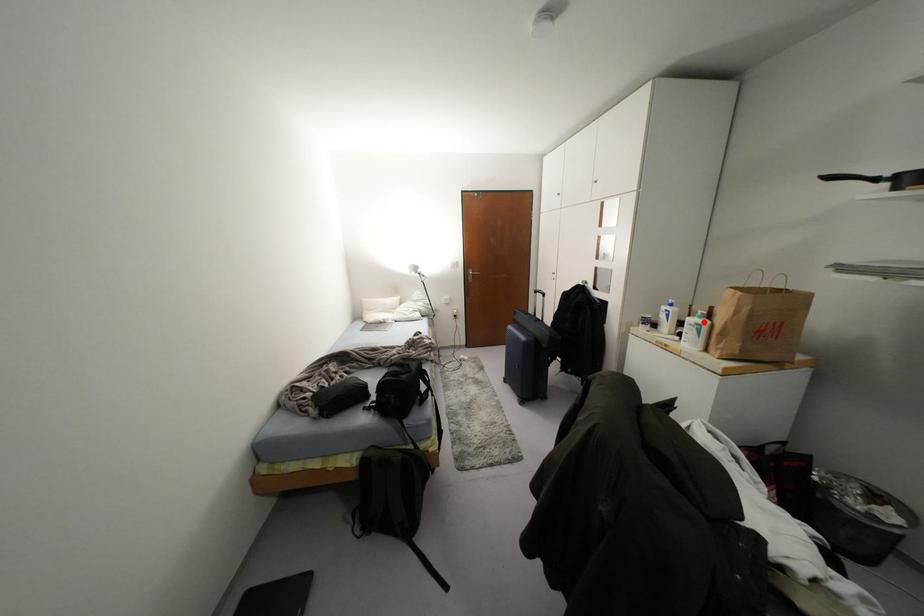
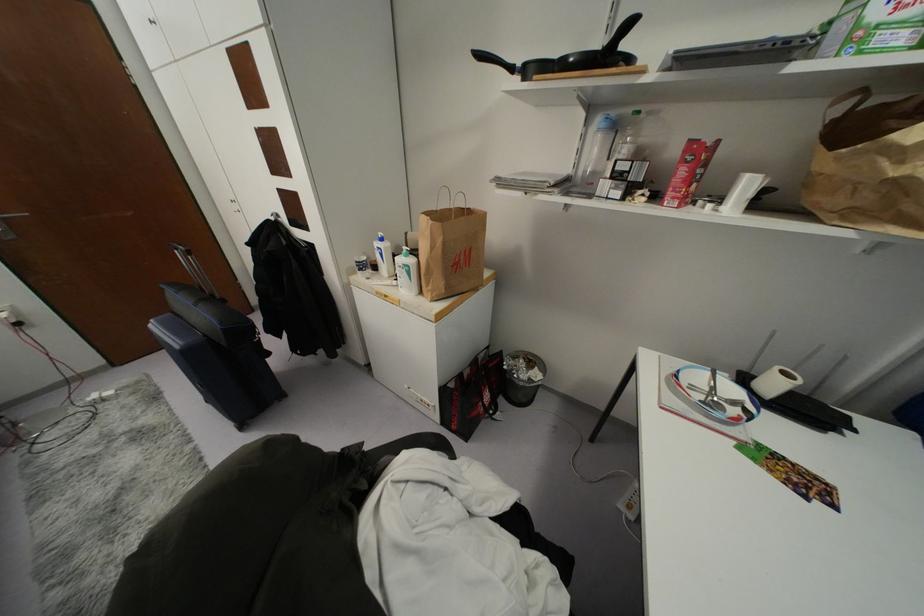
Locate, in the second image, the point that corresponds to the highlighted location in the first image.

(410, 261)